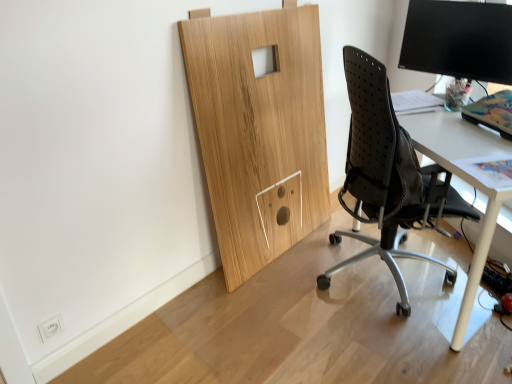
You are a GUI agent. You are given a task and a screenshot of the screen. Output one action in this format:
    pyautogui.click(x=<x>, y=<y>)
    Task: Click on the free point to the left of black mesh chair at right
    Image resolution: width=512 pixels, height=384 pixels.
    Given the screenshot: What is the action you would take?
    pyautogui.click(x=270, y=302)